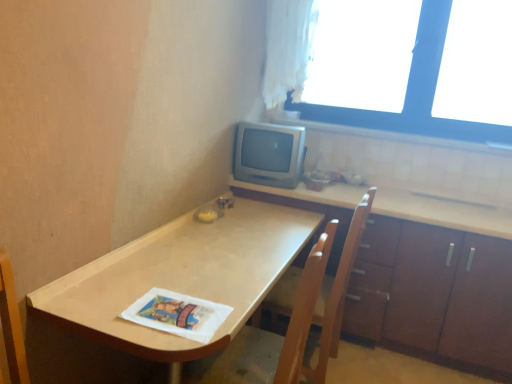
Locate an element on the screen. vacant space to the right of white paper magazine at lower center is located at coordinates (234, 311).